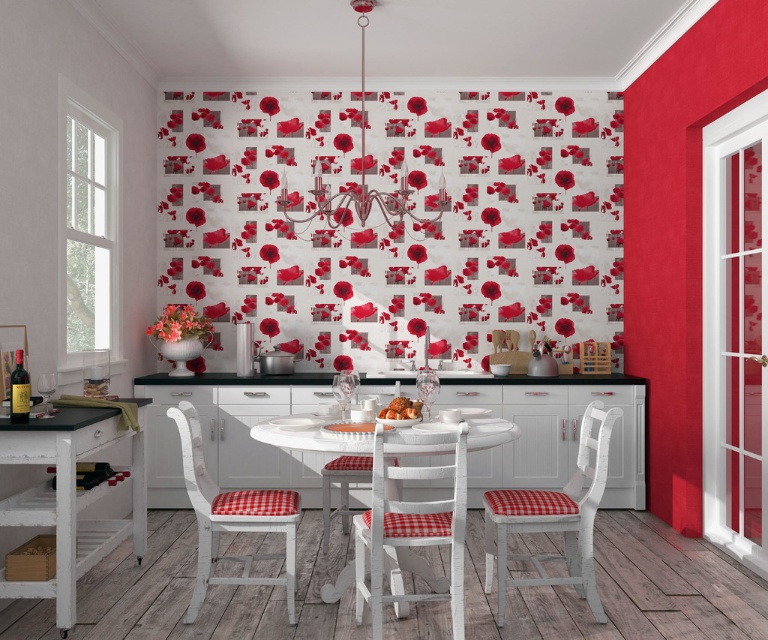
Which is more to the left, white wood table at left or white checkered chair at center?

From the viewer's perspective, white wood table at left appears more on the left side.

Which is behind, point (65, 572) or point (366, 480)?

Positioned behind is point (366, 480).

Identify the location of white wood table at left. This screenshot has height=640, width=768. (68, 499).

Does white wood table at left come in front of white wood chair with red checkered cushion at center?

No, white wood table at left is behind white wood chair with red checkered cushion at center.

Between white wood table at left and white wood chair with red checkered cushion at center, which one is positioned lower?

Positioned lower is white wood chair with red checkered cushion at center.

Is point (25, 426) farther from viewer compared to point (462, 604)?

No, it is in front of (462, 604).

Locate an element on the screen. The width and height of the screenshot is (768, 640). white wood table at left is located at coordinates (68, 499).

Consider the image. Between white wood table at left and white painted wood chair with red checkered cushion at center, which one appears on the left side from the viewer's perspective?

white wood table at left is more to the left.

The image size is (768, 640). Identify the location of white wood table at left. (68, 499).